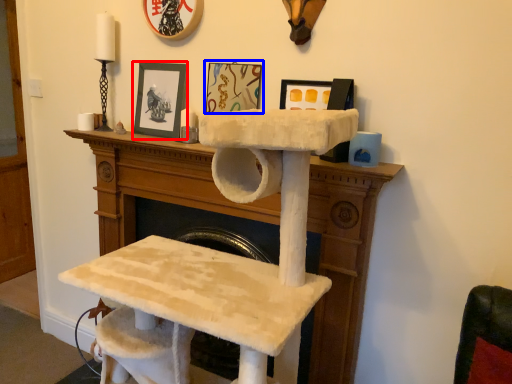
Question: Which of the following is the farthest to the observer, picture frame (highlighted by a red box) or picture frame (highlighted by a blue box)?

Choices:
 (A) picture frame
 (B) picture frame

Answer: (A)